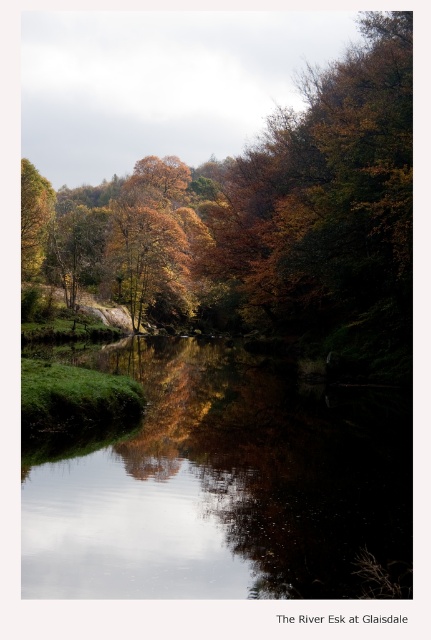
You are standing at the point labeled point (88, 452) and want to walk towards the point labeled point (218, 392). Given the serene autumn scene of The River Esk at Glaisdale, which direction should you head to reach your destination?

Since point (88, 452) is closer to the viewer than point (218, 392), you should head away from the viewer to reach point (218, 392).

You are standing at the riverside in the image and want to pick up autumn leaves at upper center and golden leafy trees at center. Which object is higher from the ground?

The autumn leaves at upper center is above golden leafy trees at center, so the autumn leaves at upper center is higher from the ground.